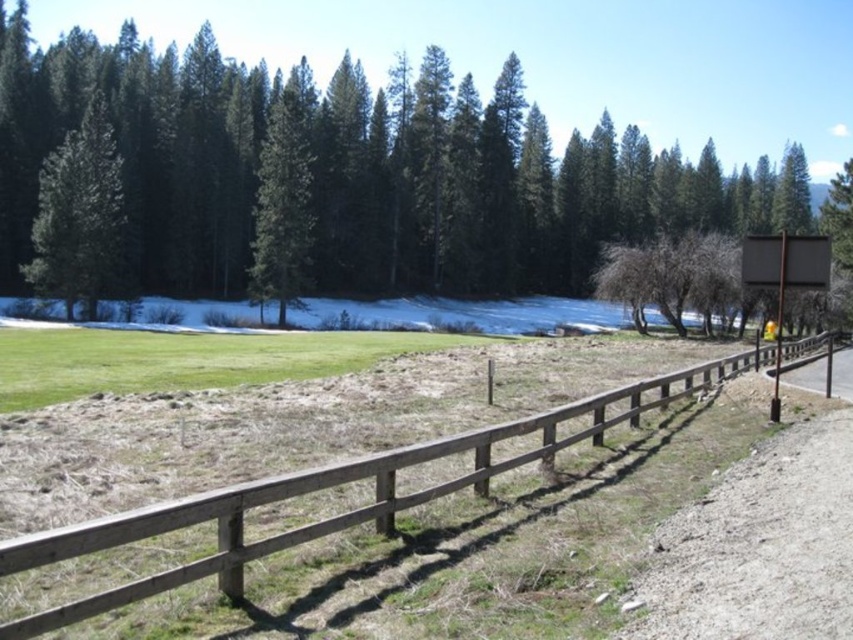
You are standing at the point closer to the camera between the two points, point 1 at coordinates point (53, 134) and point 2 at coordinates point (108, 148). Which point are you standing at?

You are standing at point (53, 134) because it is closer to the camera than point (108, 148).

You are standing on the dirt path next to the wooden fence at center and the green matte tree at upper left. Which object is taller?

The green matte tree at upper left is taller than the wooden fence at center.